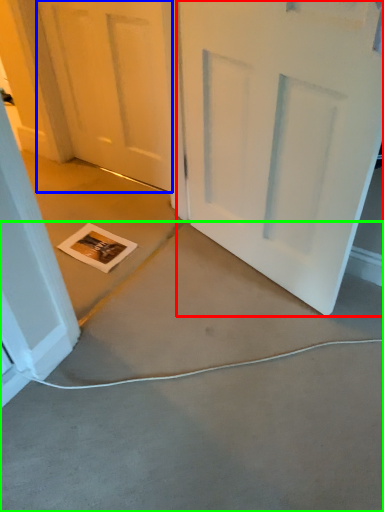
Question: Which is farther away from door (highlighted by a red box)? door (highlighted by a blue box) or concrete (highlighted by a green box)?

Choices:
 (A) door
 (B) concrete

Answer: (A)